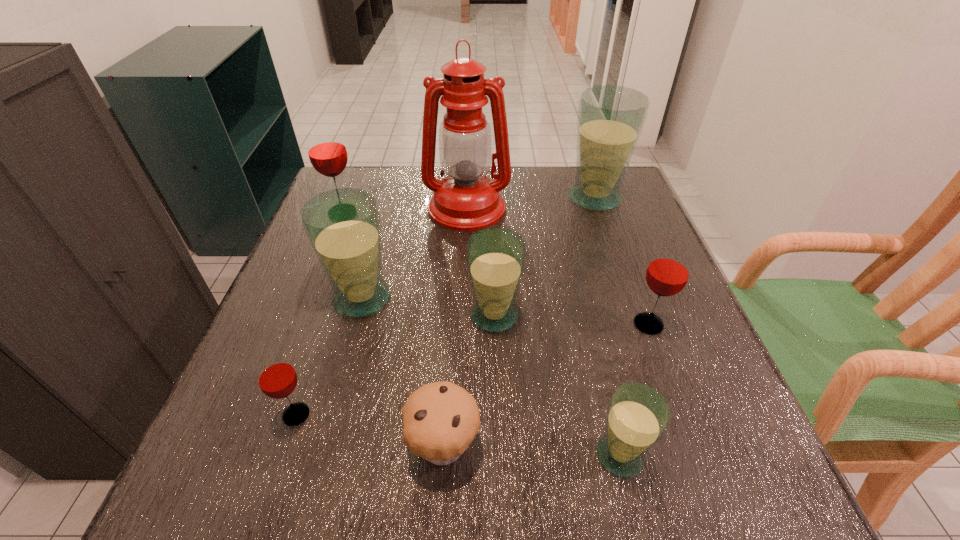
The height and width of the screenshot is (540, 960). Find the location of `vacant area between the oil lamp and the second biggest blue glass`. vacant area between the oil lamp and the second biggest blue glass is located at coordinates (415, 253).

Identify the location of free space between the muffin and the biggest red glass. Image resolution: width=960 pixels, height=540 pixels. (393, 329).

Locate an element on the screen. The width and height of the screenshot is (960, 540). empty space between the nearest blue glass and the farthest red glass is located at coordinates (481, 334).

Identify the location of object that stands as the fifth closest to the farthest blue glass. (327, 152).

Point out which object is positioned as the fourth nearest to the fourth glass from left to right. Please provide its 2D coordinates. Your answer should be formatted as a tuple, i.e. [(x, y)], where the tuple contains the x and y coordinates of a point satisfying the conditions above.

[(668, 272)]

This screenshot has height=540, width=960. I want to click on the closest glass to the farthest blue glass, so 496,257.

The width and height of the screenshot is (960, 540). Identify the location of glass that is the fifth nearest to the farthest red glass. (668, 272).

Point out which blue glass is positioned as the second nearest to the shortest object. Please provide its 2D coordinates. Your answer should be formatted as a tuple, i.e. [(x, y)], where the tuple contains the x and y coordinates of a point satisfying the conditions above.

[(637, 417)]

Select which blue glass appears as the second closest to the nearest red glass. Please provide its 2D coordinates. Your answer should be formatted as a tuple, i.e. [(x, y)], where the tuple contains the x and y coordinates of a point satisfying the conditions above.

[(496, 257)]

What are the coordinates of `the closest red glass to the biggest red glass` in the screenshot? It's located at (277, 378).